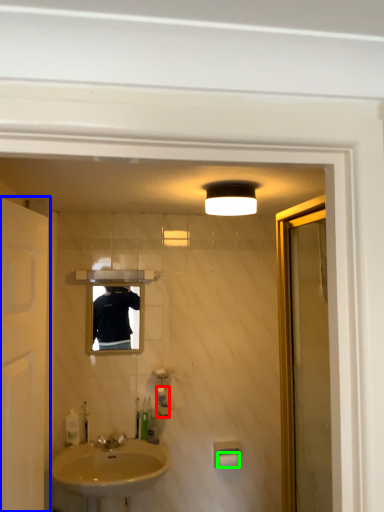
Question: Which is farther away from toiletry (highlighted by a red box)? door (highlighted by a blue box) or toilet paper (highlighted by a green box)?

Choices:
 (A) door
 (B) toilet paper

Answer: (A)